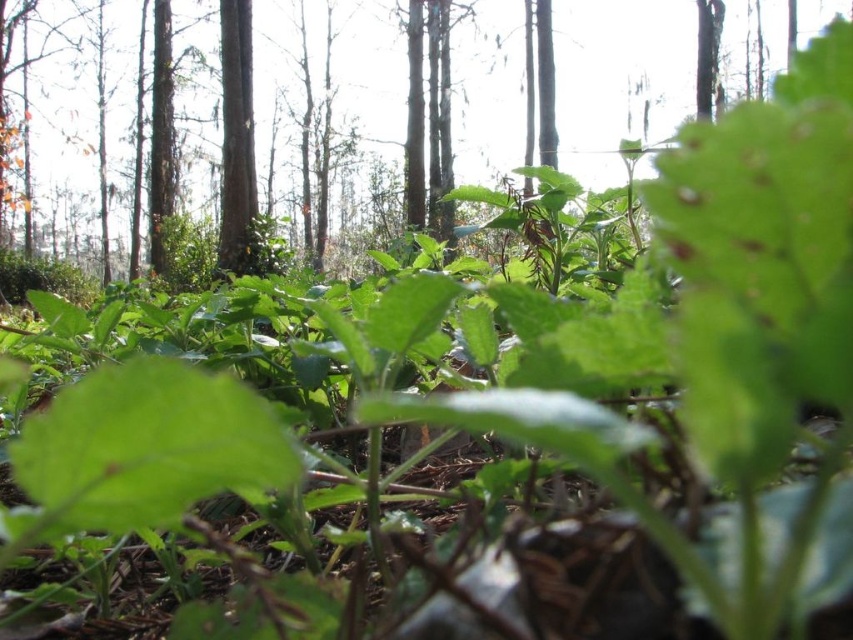
You are standing in the forest looking at the image. There is a point at coordinates (619, 77). What object is located at this point?

The point at coordinates (619, 77) marks a green leafy plant at center.

You are a hiker trying to identify the nearest object in the scene. From your perspective, which is closer to you between the green leafy plant at center and the smooth brown tree trunk at upper center?

The green leafy plant at center is closer to the viewer than the smooth brown tree trunk at upper center.

You are a gardener who wants to plant a new green leafy plant at center in your garden. The existing plants are spaced 26.87 inches apart. Is this spacing sufficient for the new plant to grow properly?

The existing plants are spaced 26.87 inches apart, which is sufficient for the new green leafy plant at center to grow properly as this spacing allows adequate room for root development and access to sunlight.